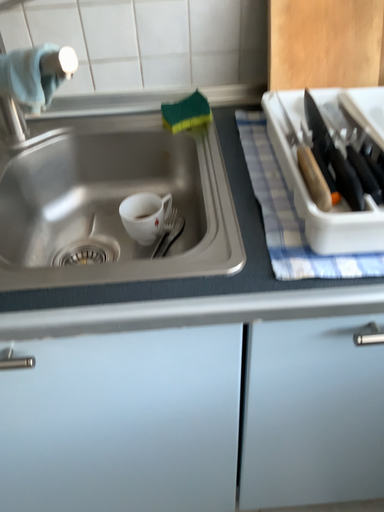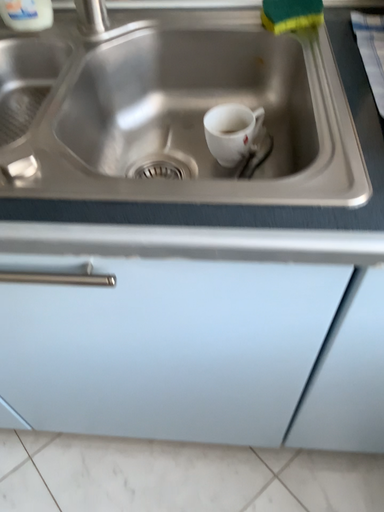
Question: How did the camera likely rotate when shooting the video?

Choices:
 (A) rotated downward
 (B) rotated upward

Answer: (A)